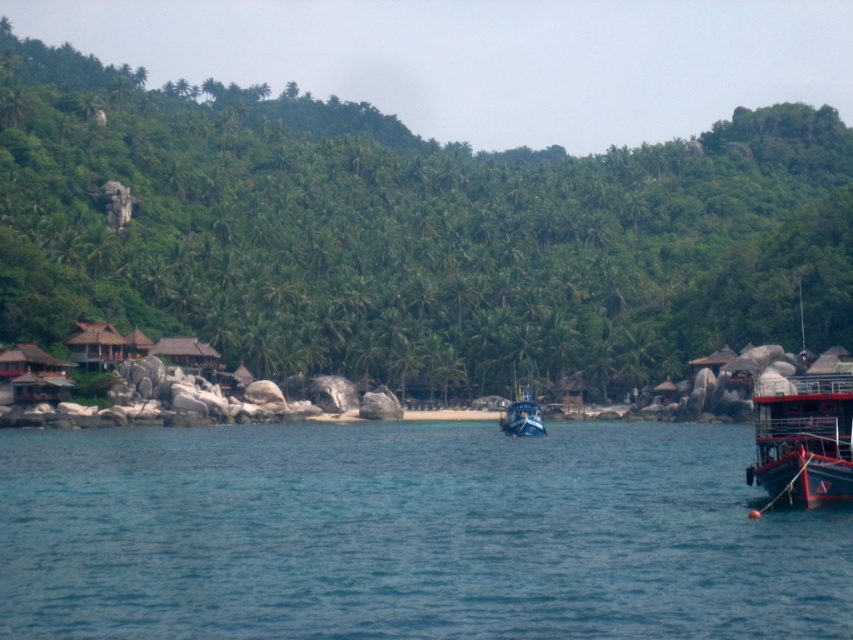
Is green leafy tree at center further to camera compared to red painted metal boat at right?

That is True.

Measure the distance between point [819,129] and camera.

Point [819,129] and camera are 258.31 meters apart from each other.

Locate an element on the screen. green leafy tree at center is located at coordinates (408, 234).

Can you confirm if green leafy tree at center is wider than blue water at center?

Correct, the width of green leafy tree at center exceeds that of blue water at center.

This screenshot has height=640, width=853. What do you see at coordinates (408, 234) in the screenshot?
I see `green leafy tree at center` at bounding box center [408, 234].

Locate an element on the screen. Image resolution: width=853 pixels, height=640 pixels. green leafy tree at center is located at coordinates (408, 234).

Describe the element at coordinates (408, 534) in the screenshot. I see `blue water at center` at that location.

Does blue water at center have a lesser width compared to red painted metal boat at right?

No, blue water at center is not thinner than red painted metal boat at right.

Where is `blue water at center`? The height and width of the screenshot is (640, 853). blue water at center is located at coordinates (408, 534).